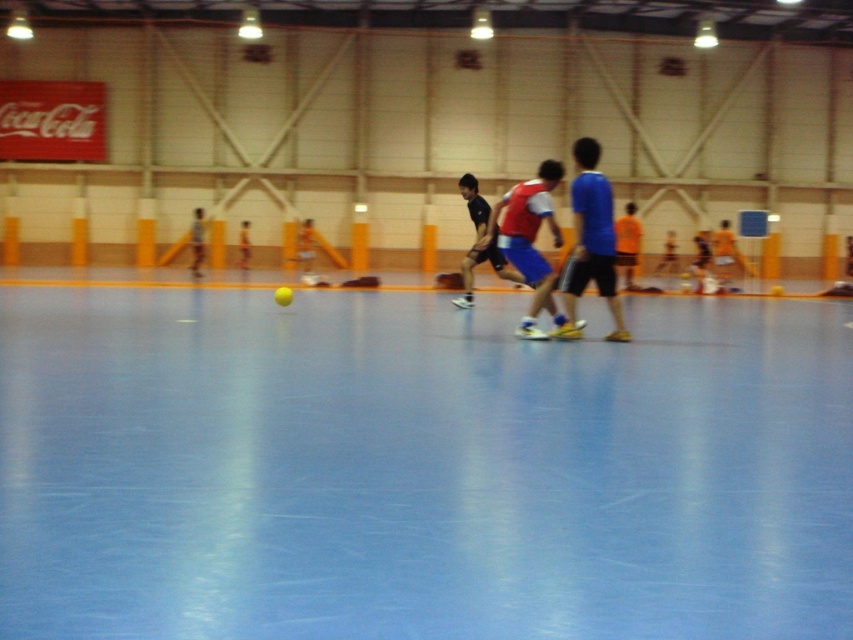
Question: Which point is farther to the camera?

Choices:
 (A) (550, 173)
 (B) (576, 269)

Answer: (A)

Question: Is blue matte shorts at center to the right of matte red jersey at center from the viewer's perspective?

Choices:
 (A) yes
 (B) no

Answer: (A)

Question: Can you confirm if blue matte shorts at center is positioned above matte red jersey at center?

Choices:
 (A) no
 (B) yes

Answer: (B)

Question: Which point is closer to the camera?

Choices:
 (A) matte red jersey at center
 (B) blue matte shorts at center

Answer: (B)

Question: Is blue matte shorts at center closer to the viewer compared to matte red jersey at center?

Choices:
 (A) yes
 (B) no

Answer: (A)